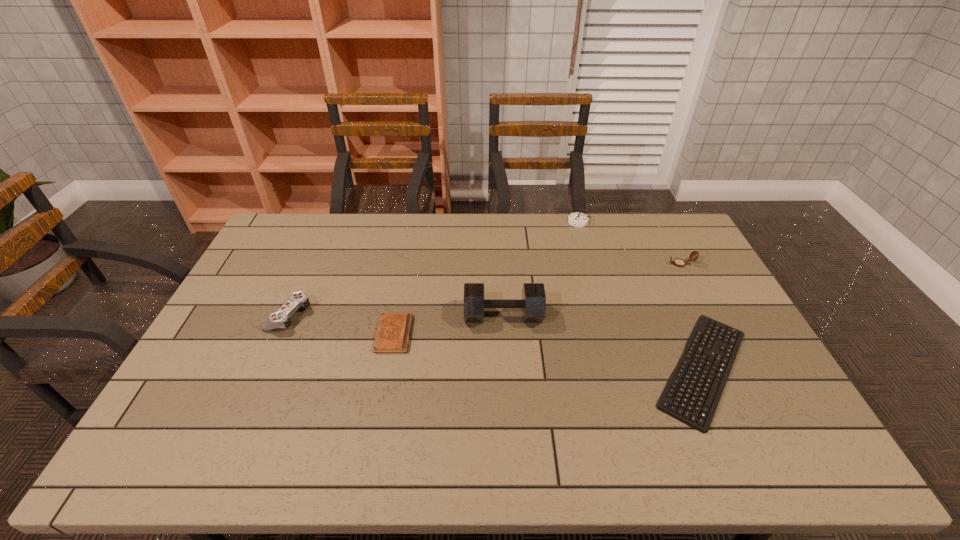
Image resolution: width=960 pixels, height=540 pixels. Find the location of `the third object from left to right`. the third object from left to right is located at coordinates (533, 303).

Find the location of a particular element. The image size is (960, 540). the tallest object is located at coordinates (533, 303).

Locate an element on the screen. The image size is (960, 540). the fourth object from left to right is located at coordinates (577, 219).

The width and height of the screenshot is (960, 540). What are the coordinates of `the farther compass` in the screenshot? It's located at (577, 219).

The image size is (960, 540). I want to click on the leftmost object, so click(279, 319).

Where is `the second farthest object`? the second farthest object is located at coordinates (678, 262).

The height and width of the screenshot is (540, 960). In order to click on the right compass in this screenshot , I will do `click(678, 262)`.

The width and height of the screenshot is (960, 540). I want to click on diary, so click(x=393, y=334).

This screenshot has width=960, height=540. Identify the location of computer keyboard. (667, 396).

Locate an element on the screen. vacant region located on the back of the dumbbell is located at coordinates (500, 249).